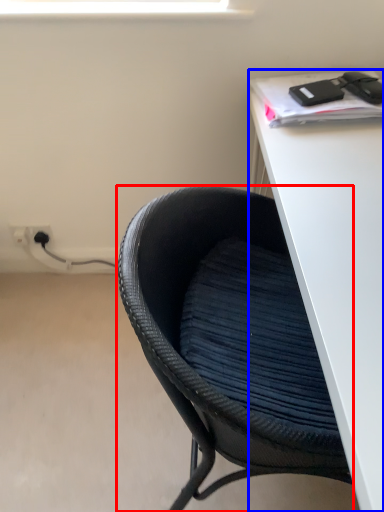
Question: Which of the following is the closest to the observer, chair (highlighted by a red box) or desk (highlighted by a blue box)?

Choices:
 (A) chair
 (B) desk

Answer: (B)